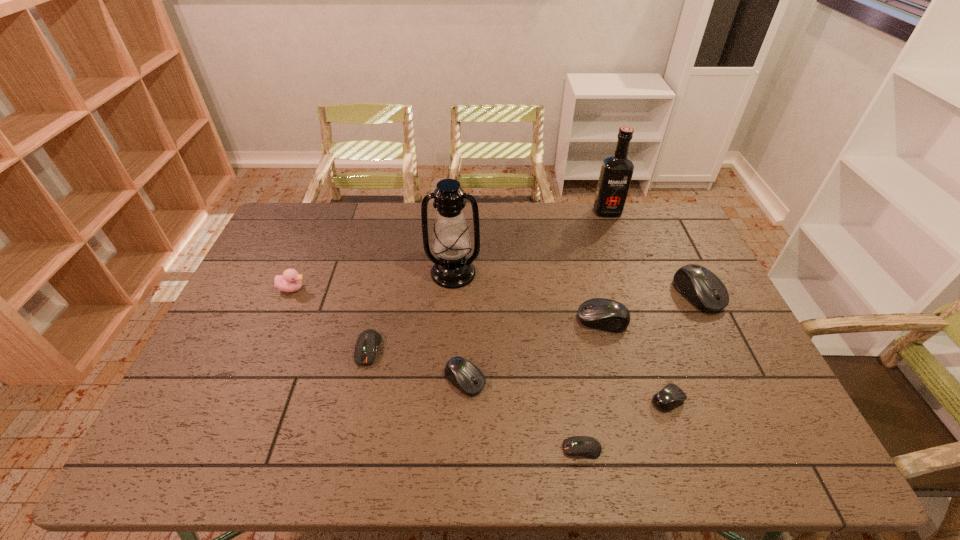
The image size is (960, 540). Find the location of `the farthest object`. the farthest object is located at coordinates (616, 172).

Find the location of a particular element. This screenshot has width=960, height=540. black liquor is located at coordinates (616, 172).

You are a GUI agent. You are given a task and a screenshot of the screen. Output one action in this format:
    pyautogui.click(x=<x>, y=<y>)
    Task: Click on the oil lamp
    The width and height of the screenshot is (960, 540).
    Given the screenshot: What is the action you would take?
    pyautogui.click(x=451, y=242)

At what (x,y) coordinates should I click in order to perform the action: click on duckling. Please return your answer as a coordinate pair (x, y). The image size is (960, 540). Looking at the image, I should click on (290, 281).

You are a GUI agent. You are given a task and a screenshot of the screen. Output one action in this format:
    pyautogui.click(x=<x>, y=<y>)
    Task: Click on the pink duckling
    
    Given the screenshot: What is the action you would take?
    pyautogui.click(x=290, y=281)

The height and width of the screenshot is (540, 960). What are the coordinates of `the biggest black mouse` in the screenshot? It's located at (701, 287).

Identify the location of the tallest computer equipment. (701, 287).

The height and width of the screenshot is (540, 960). I want to click on the fifth tallest object, so click(604, 314).

Where is `the second biggest black mouse`? the second biggest black mouse is located at coordinates (604, 314).

Where is `the leftmost black mouse`? the leftmost black mouse is located at coordinates (468, 378).